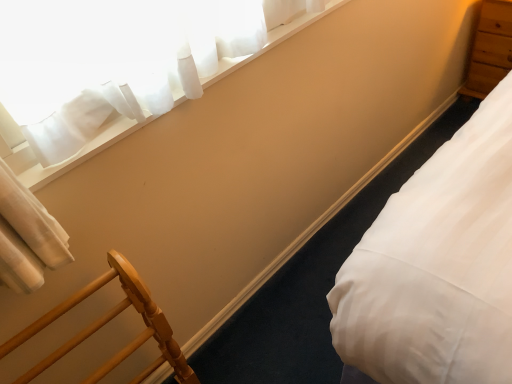
Question: From the image's perspective, is light brown wood dresser at upper right under white smooth bed at lower right?

Choices:
 (A) no
 (B) yes

Answer: (A)

Question: Is white smooth bed at lower right completely or partially inside light brown wood dresser at upper right?

Choices:
 (A) yes
 (B) no

Answer: (B)

Question: Is light brown wood dresser at upper right turned away from white smooth bed at lower right?

Choices:
 (A) no
 (B) yes

Answer: (A)

Question: Considering the relative sizes of light brown wood dresser at upper right and white smooth bed at lower right in the image provided, is light brown wood dresser at upper right taller than white smooth bed at lower right?

Choices:
 (A) no
 (B) yes

Answer: (B)

Question: Is light brown wood dresser at upper right positioned behind white smooth bed at lower right?

Choices:
 (A) yes
 (B) no

Answer: (A)

Question: Considering the positions of point (259, 16) and point (99, 375), is point (259, 16) closer or farther from the camera than point (99, 375)?

Choices:
 (A) closer
 (B) farther

Answer: (B)

Question: Looking at the image, does white sheer curtain at upper left seem bigger or smaller compared to wooden chair at lower left?

Choices:
 (A) big
 (B) small

Answer: (B)

Question: Would you say white sheer curtain at upper left is to the left or to the right of wooden chair at lower left in the picture?

Choices:
 (A) left
 (B) right

Answer: (B)

Question: Is white sheer curtain at upper left taller or shorter than wooden chair at lower left?

Choices:
 (A) tall
 (B) short

Answer: (B)

Question: In terms of size, does wooden chair at lower left appear bigger or smaller than white sheer curtain at upper left?

Choices:
 (A) big
 (B) small

Answer: (A)

Question: Would you say wooden chair at lower left is to the left or to the right of white sheer curtain at upper left in the picture?

Choices:
 (A) left
 (B) right

Answer: (A)

Question: Is wooden chair at lower left inside or outside of white sheer curtain at upper left?

Choices:
 (A) outside
 (B) inside

Answer: (A)

Question: From their relative heights in the image, would you say wooden chair at lower left is taller or shorter than white sheer curtain at upper left?

Choices:
 (A) tall
 (B) short

Answer: (A)

Question: From a real-world perspective, relative to wooden chair at lower left, is light brown wood dresser at upper right vertically above or below?

Choices:
 (A) below
 (B) above

Answer: (A)

Question: Considering the positions of light brown wood dresser at upper right and wooden chair at lower left in the image, is light brown wood dresser at upper right wider or thinner than wooden chair at lower left?

Choices:
 (A) wide
 (B) thin

Answer: (A)